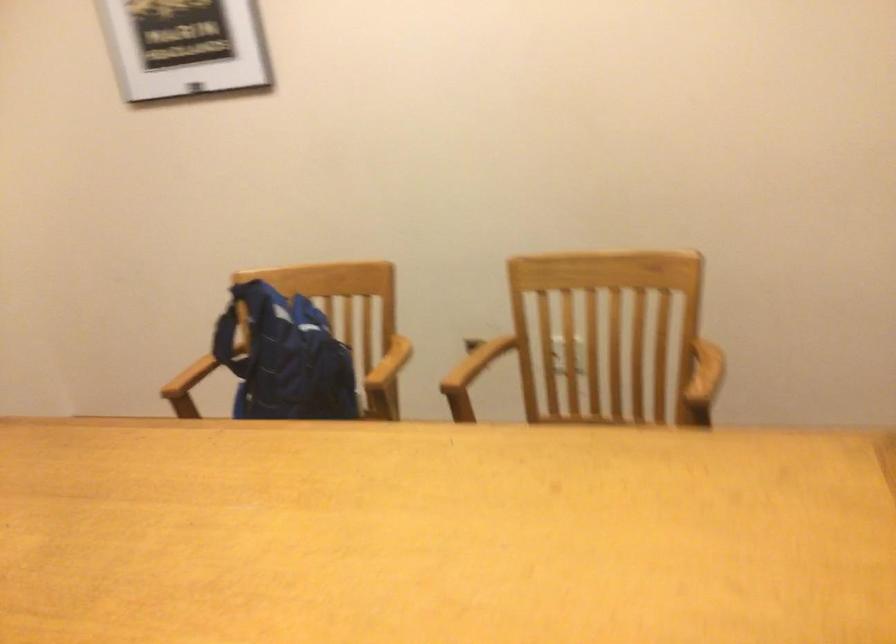
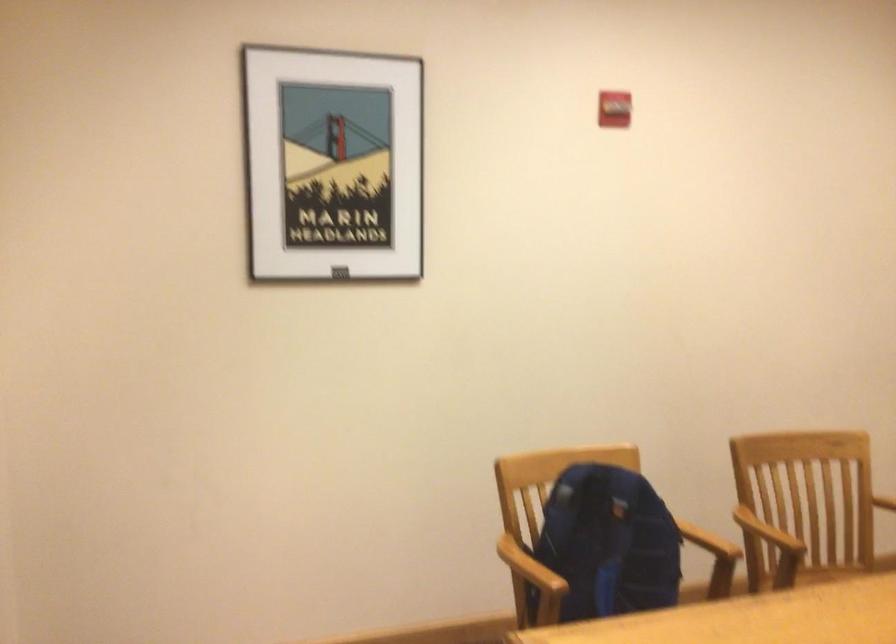
Question: I am providing you with two images of the same scene from different viewpoints. Which of the following objects are not visible in image2?

Choices:
 (A) chair sitting surface
 (B) blue backpack
 (C) wooden chair armrest
 (D) none of these

Answer: (D)